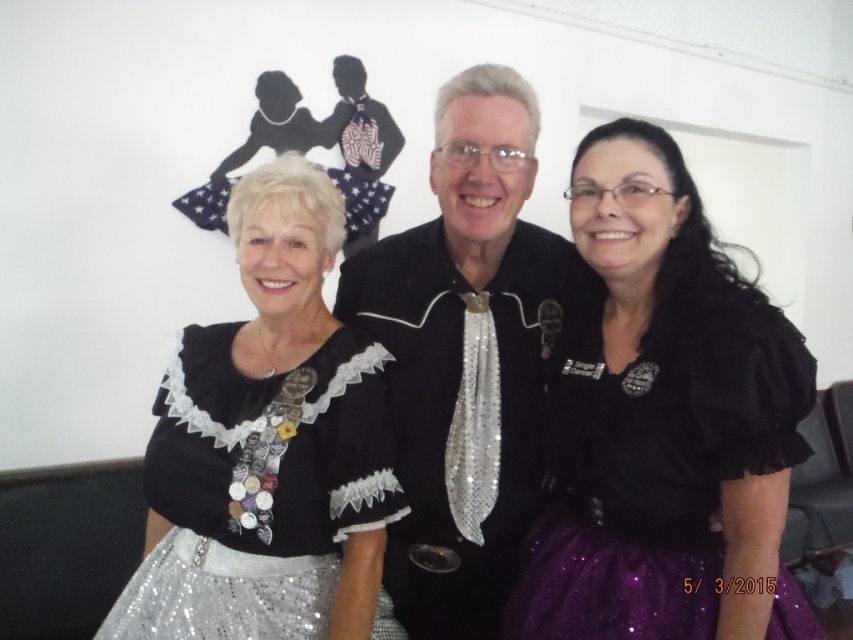
Question: Is shiny purple skirt at center below black sequined jacket at center?

Choices:
 (A) yes
 (B) no

Answer: (A)

Question: Which of the following is the farthest from the observer?

Choices:
 (A) shiny purple skirt at center
 (B) black sequined jacket at center
 (C) silver sequined dress at lower left

Answer: (B)

Question: Is black sequined jacket at center wider than silver sequined dress at lower left?

Choices:
 (A) yes
 (B) no

Answer: (B)

Question: Estimate the real-world distances between objects in this image. Which object is closer to the silver sequined dress at lower left?

Choices:
 (A) shiny purple skirt at center
 (B) black sequined jacket at center

Answer: (B)

Question: Is shiny purple skirt at center smaller than silver sequined dress at lower left?

Choices:
 (A) yes
 (B) no

Answer: (B)

Question: Which point is closer to the camera?

Choices:
 (A) black sequined jacket at center
 (B) shiny purple skirt at center

Answer: (B)